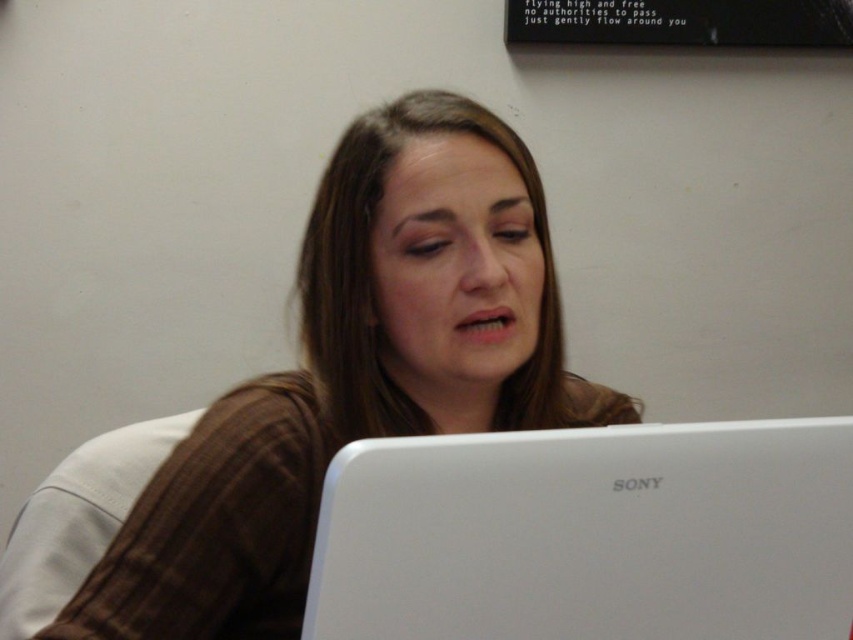
Consider the image. Is brown textured shirt at center to the left of white matte laptop at lower center from the viewer's perspective?

Indeed, brown textured shirt at center is positioned on the left side of white matte laptop at lower center.

Is brown textured shirt at center to the right of white matte laptop at lower center from the viewer's perspective?

In fact, brown textured shirt at center is to the left of white matte laptop at lower center.

Where is `brown textured shirt at center`? Image resolution: width=853 pixels, height=640 pixels. brown textured shirt at center is located at coordinates click(x=354, y=372).

Where is `brown textured shirt at center`? The image size is (853, 640). brown textured shirt at center is located at coordinates (354, 372).